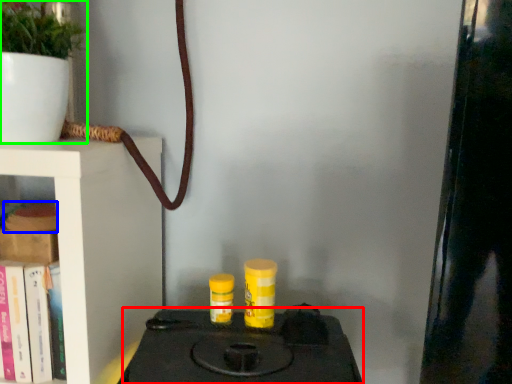
Question: Which object is the farthest from stove (highlighted by a red box)? Choose among these: book (highlighted by a blue box) or houseplant (highlighted by a green box).

Choices:
 (A) book
 (B) houseplant

Answer: (B)